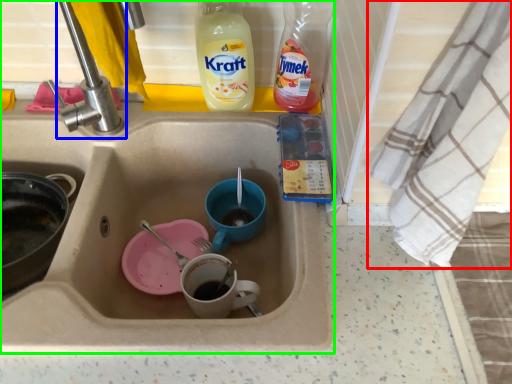
Question: Estimate the real-world distances between objects in this image. Which object is closer to cloth (highlighted by a red box), tap (highlighted by a blue box) or sink (highlighted by a green box)?

Choices:
 (A) tap
 (B) sink

Answer: (B)